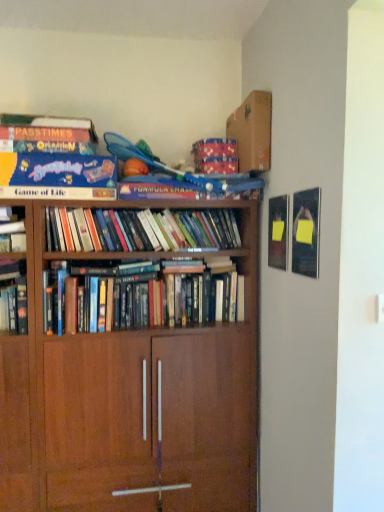
At what (x,y) coordinates should I click in order to perform the action: click on hardcover books at center, placed as the 2th book when sorted from top to bottom. Please return your answer as a coordinate pair (x, y). Looking at the image, I should click on (141, 230).

Image resolution: width=384 pixels, height=512 pixels. Describe the element at coordinates (141, 230) in the screenshot. I see `hardcover books at center, acting as the 2th book starting from the bottom` at that location.

Locate an element on the screen. The image size is (384, 512). brown wood bookcase at center is located at coordinates (130, 406).

Where is `hardcover books at center, placed as the 1th book when sorted from bottom to top`? The width and height of the screenshot is (384, 512). hardcover books at center, placed as the 1th book when sorted from bottom to top is located at coordinates (149, 295).

Where is `cardboard at upper center`? The image size is (384, 512). cardboard at upper center is located at coordinates (252, 132).

Which is in front, point (17, 162) or point (223, 240)?

Positioned in front is point (17, 162).

Are blue cardboard game of life at upper left, arranged as the third book when ordered from the bottom, and hardcover books at center, placed as the 2th book when sorted from top to bottom, located far from each other?

They are positioned close to each other.

In order to click on book that is the 2nd one when counting forward from the hardcover books at center, acting as the 2th book starting from the bottom in this screenshot , I will do `click(53, 159)`.

From the image's perspective, which is above, blue cardboard game of life at upper left, placed as the first book when sorted from top to bottom, or hardcover books at center, acting as the 2th book starting from the bottom?

blue cardboard game of life at upper left, placed as the first book when sorted from top to bottom.

Is cardboard at upper center behind brown wood bookcase at center?

Yes, cardboard at upper center is further from the viewer.

Can you confirm if cardboard at upper center is positioned to the left of brown wood bookcase at center?

No, cardboard at upper center is not to the left of brown wood bookcase at center.

How different are the orientations of cardboard at upper center and brown wood bookcase at center in degrees?

cardboard at upper center and brown wood bookcase at center are facing 0.68 degrees away from each other.

Is cardboard at upper center facing away from brown wood bookcase at center?

cardboard at upper center does not have its back to brown wood bookcase at center.

Which of these two, cardboard at upper center or hardcover books at center, placed as the 1th book when sorted from bottom to top, stands taller?

cardboard at upper center is taller.

What's the angular difference between cardboard at upper center and hardcover books at center, the 3th book in the top-to-bottom sequence,'s facing directions?

The angle between the facing direction of cardboard at upper center and the facing direction of hardcover books at center, the 3th book in the top-to-bottom sequence, is 1.14 degrees.

Does cardboard at upper center turn towards hardcover books at center, placed as the 1th book when sorted from bottom to top?

No, cardboard at upper center is not turned towards hardcover books at center, placed as the 1th book when sorted from bottom to top.

From a real-world perspective, is cardboard at upper center below hardcover books at center, placed as the 1th book when sorted from bottom to top?

No, from a real-world perspective, cardboard at upper center is not below hardcover books at center, placed as the 1th book when sorted from bottom to top.

There is a brown wood bookcase at center. At what (x,y) coordinates should I click in order to perform the action: click on the 2nd book above it (from the image's perspective). Please return your answer as a coordinate pair (x, y). Looking at the image, I should click on click(x=141, y=230).

How different are the orientations of brown wood bookcase at center and hardcover books at center, acting as the 2th book starting from the bottom, in degrees?

0.465 degrees separate the facing orientations of brown wood bookcase at center and hardcover books at center, acting as the 2th book starting from the bottom.

From a real-world perspective, which object rests below the other?

brown wood bookcase at center, from a real-world perspective.

Looking at the image, does brown wood bookcase at center seem bigger or smaller compared to hardcover books at center, placed as the 2th book when sorted from top to bottom?

brown wood bookcase at center is bigger than hardcover books at center, placed as the 2th book when sorted from top to bottom.

Does hardcover books at center, placed as the 1th book when sorted from bottom to top, have a larger size compared to brown wood bookcase at center?

Actually, hardcover books at center, placed as the 1th book when sorted from bottom to top, might be smaller than brown wood bookcase at center.

Is hardcover books at center, placed as the 1th book when sorted from bottom to top, taller than brown wood bookcase at center?

No, hardcover books at center, placed as the 1th book when sorted from bottom to top, is not taller than brown wood bookcase at center.

Is hardcover books at center, placed as the 1th book when sorted from bottom to top, in contact with brown wood bookcase at center?

They are not placed beside each other.

Which is in front, hardcover books at center, placed as the 1th book when sorted from bottom to top, or brown wood bookcase at center?

brown wood bookcase at center is in front.

From a real-world perspective, is blue cardboard game of life at upper left, arranged as the third book when ordered from the bottom, over cardboard at upper center?

No.

Is blue cardboard game of life at upper left, arranged as the third book when ordered from the bottom, beside cardboard at upper center?

No, blue cardboard game of life at upper left, arranged as the third book when ordered from the bottom, is not making contact with cardboard at upper center.

Consider the image. Considering the sizes of objects blue cardboard game of life at upper left, placed as the first book when sorted from top to bottom, and cardboard at upper center in the image provided, who is shorter, blue cardboard game of life at upper left, placed as the first book when sorted from top to bottom, or cardboard at upper center?

With less height is cardboard at upper center.

Looking at this image, between blue cardboard game of life at upper left, placed as the first book when sorted from top to bottom, and cardboard at upper center, which one appears on the left side from the viewer's perspective?

From the viewer's perspective, blue cardboard game of life at upper left, placed as the first book when sorted from top to bottom, appears more on the left side.

Is the depth of hardcover books at center, placed as the 1th book when sorted from bottom to top, greater than that of cardboard at upper center?

No, hardcover books at center, placed as the 1th book when sorted from bottom to top, is closer to the viewer.

Is hardcover books at center, the 3th book in the top-to-bottom sequence, with cardboard at upper center?

hardcover books at center, the 3th book in the top-to-bottom sequence, is not next to cardboard at upper center, and they're not touching.

Is hardcover books at center, the 3th book in the top-to-bottom sequence, thinner than cardboard at upper center?

Yes, hardcover books at center, the 3th book in the top-to-bottom sequence, is thinner than cardboard at upper center.

Find the location of a particular element. the 3rd book below the cardboard at upper center (from the image's perspective) is located at coordinates (149, 295).

Starting from the blue cardboard game of life at upper left, arranged as the third book when ordered from the bottom, which book is the 2nd one behind? Please provide its 2D coordinates.

[(141, 230)]

This screenshot has width=384, height=512. There is a brown wood bookcase at center. Find the location of `cardboard box above it (from a real-world perspective)`. cardboard box above it (from a real-world perspective) is located at coordinates tap(252, 132).

From the picture: Estimate the real-world distances between objects in this image. Which object is further from hardcover books at center, acting as the 2th book starting from the bottom, hardcover books at center, the 3th book in the top-to-bottom sequence, or blue cardboard game of life at upper left, arranged as the third book when ordered from the bottom?

blue cardboard game of life at upper left, arranged as the third book when ordered from the bottom, is positioned further to the anchor hardcover books at center, acting as the 2th book starting from the bottom.

Considering their positions, is brown wood bookcase at center positioned further to cardboard at upper center than hardcover books at center, the 3th book in the top-to-bottom sequence?

brown wood bookcase at center is positioned further to the anchor cardboard at upper center.

Which object lies nearer to the anchor point hardcover books at center, the 3th book in the top-to-bottom sequence, hardcover books at center, placed as the 2th book when sorted from top to bottom, or blue cardboard game of life at upper left, arranged as the third book when ordered from the bottom?

hardcover books at center, placed as the 2th book when sorted from top to bottom, lies closer to hardcover books at center, the 3th book in the top-to-bottom sequence, than the other object.

In the scene shown: Estimate the real-world distances between objects in this image. Which object is further from brown wood bookcase at center, hardcover books at center, the 3th book in the top-to-bottom sequence, or cardboard at upper center?

Among the two, cardboard at upper center is located further to brown wood bookcase at center.

When comparing their distances from blue cardboard game of life at upper left, arranged as the third book when ordered from the bottom, does hardcover books at center, acting as the 2th book starting from the bottom, or hardcover books at center, placed as the 1th book when sorted from bottom to top, seem closer?

hardcover books at center, acting as the 2th book starting from the bottom, is closer to blue cardboard game of life at upper left, arranged as the third book when ordered from the bottom.

Based on their spatial positions, is hardcover books at center, placed as the 1th book when sorted from bottom to top, or hardcover books at center, acting as the 2th book starting from the bottom, further from brown wood bookcase at center?

hardcover books at center, acting as the 2th book starting from the bottom.

Which object lies nearer to the anchor point hardcover books at center, the 3th book in the top-to-bottom sequence, cardboard at upper center or blue cardboard game of life at upper left, arranged as the third book when ordered from the bottom?

blue cardboard game of life at upper left, arranged as the third book when ordered from the bottom, is positioned closer to the anchor hardcover books at center, the 3th book in the top-to-bottom sequence.

From the image, which object appears to be nearer to brown wood bookcase at center, hardcover books at center, placed as the 2th book when sorted from top to bottom, or blue cardboard game of life at upper left, placed as the first book when sorted from top to bottom?

hardcover books at center, placed as the 2th book when sorted from top to bottom, is closer to brown wood bookcase at center.

Where is `book that lies between hardcover books at center, placed as the 2th book when sorted from top to bottom, and brown wood bookcase at center from top to bottom`? book that lies between hardcover books at center, placed as the 2th book when sorted from top to bottom, and brown wood bookcase at center from top to bottom is located at coordinates (149, 295).

Locate an element on the screen. book between blue cardboard game of life at upper left, placed as the first book when sorted from top to bottom, and hardcover books at center, the 3th book in the top-to-bottom sequence, in the vertical direction is located at coordinates (141, 230).